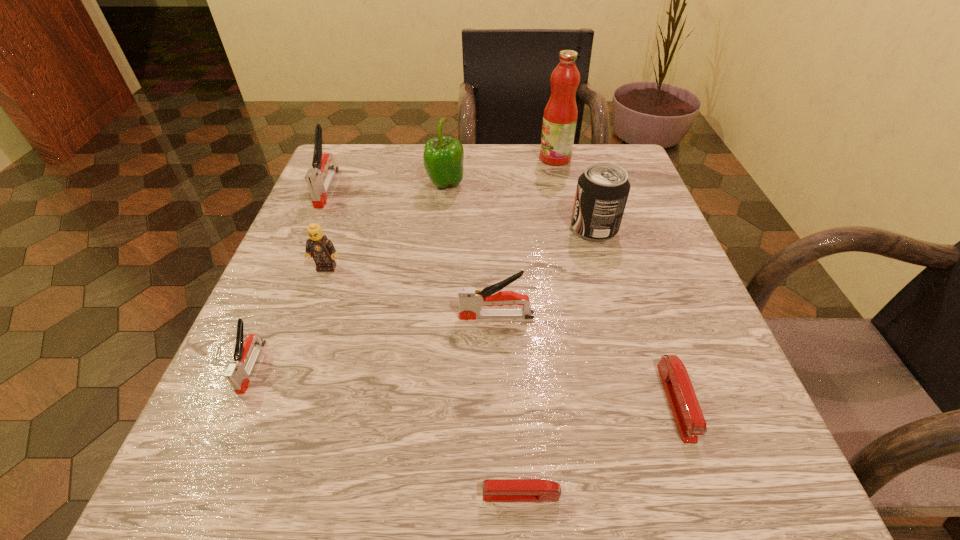
Identify which object is located as the eighth nearest to the fourth farthest object. Please provide its 2D coordinates. Your answer should be formatted as a tuple, i.e. [(x, y)], where the tuple contains the x and y coordinates of a point satisfying the conditions above.

[(238, 374)]

Choose which stapler is the fourth nearest neighbor to the nearest stapler. Please provide its 2D coordinates. Your answer should be formatted as a tuple, i.e. [(x, y)], where the tuple contains the x and y coordinates of a point satisfying the conditions above.

[(319, 190)]

The width and height of the screenshot is (960, 540). What are the coordinates of `the fourth closest stapler relative to the rightmost stapler` in the screenshot? It's located at (319, 190).

Identify the location of gray stapler that can be found as the third closest to the third object from left to right. (471, 299).

Identify which gray stapler is the second nearest to the soda can. Please provide its 2D coordinates. Your answer should be formatted as a tuple, i.e. [(x, y)], where the tuple contains the x and y coordinates of a point satisfying the conditions above.

[(319, 190)]

Identify the location of vacant space that satisfies the following two spatial constraints: 1. on the front-facing side of the rightmost stapler; 2. on the front-facing side of the nearer red stapler. This screenshot has width=960, height=540. (708, 495).

Locate an element on the screen. Image resolution: width=960 pixels, height=540 pixels. free space that satisfies the following two spatial constraints: 1. on the front label of the black soda can; 2. on the right side of the fruit juice is located at coordinates (571, 228).

This screenshot has width=960, height=540. I want to click on free spot that satisfies the following two spatial constraints: 1. on the front label of the pink fruit juice; 2. on the handle side of the smallest gray stapler, so click(x=603, y=367).